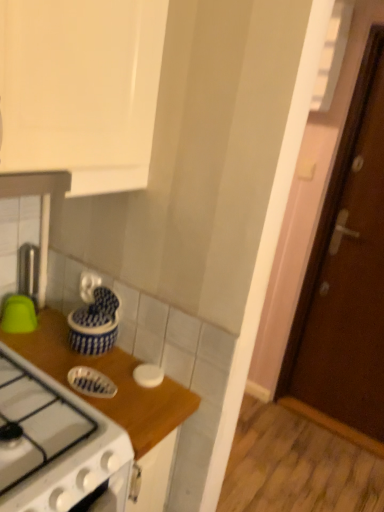
Question: Can you confirm if blue glossy dish at center, arranged as the 2th kitchen appliance when viewed from the right, is taller than brown wooden door at right?

Choices:
 (A) no
 (B) yes

Answer: (A)

Question: Is the position of blue glossy dish at center, arranged as the 2th kitchen appliance when viewed from the right, more distant than that of brown wooden door at right?

Choices:
 (A) no
 (B) yes

Answer: (A)

Question: From the image's perspective, does blue glossy dish at center, arranged as the 2th kitchen appliance when viewed from the right, appear higher than brown wooden door at right?

Choices:
 (A) no
 (B) yes

Answer: (A)

Question: From a real-world perspective, is blue glossy dish at center, arranged as the 2th kitchen appliance when viewed from the right, positioned over brown wooden door at right based on gravity?

Choices:
 (A) yes
 (B) no

Answer: (B)

Question: Considering the relative sizes of blue glossy dish at center, the 3th kitchen appliance from the left, and brown wooden door at right in the image provided, is blue glossy dish at center, the 3th kitchen appliance from the left, shorter than brown wooden door at right?

Choices:
 (A) yes
 (B) no

Answer: (A)

Question: Is wooden at upper right taller or shorter than blue glossy jar at center, which ranks as the third kitchen appliance in right-to-left order?

Choices:
 (A) short
 (B) tall

Answer: (B)

Question: Does point 135,428 appear closer or farther from the camera than point 89,338?

Choices:
 (A) farther
 (B) closer

Answer: (B)

Question: Considering their positions, is wooden at upper right located in front of or behind blue glossy jar at center, which is counted as the second kitchen appliance, starting from the left?

Choices:
 (A) behind
 (B) front

Answer: (B)

Question: Is wooden at upper right bigger or smaller than blue glossy jar at center, which is counted as the second kitchen appliance, starting from the left?

Choices:
 (A) small
 (B) big

Answer: (B)

Question: Looking at their shapes, would you say green matte bowl at left, acting as the fourth kitchen appliance starting from the right, is wider or thinner than blue glossy jar at center, which is counted as the second kitchen appliance, starting from the left?

Choices:
 (A) wide
 (B) thin

Answer: (B)

Question: From a real-world perspective, is green matte bowl at left, acting as the fourth kitchen appliance starting from the right, positioned above or below blue glossy jar at center, which ranks as the third kitchen appliance in right-to-left order?

Choices:
 (A) above
 (B) below

Answer: (B)

Question: From the image's perspective, is green matte bowl at left, acting as the fourth kitchen appliance starting from the right, above or below blue glossy jar at center, which ranks as the third kitchen appliance in right-to-left order?

Choices:
 (A) above
 (B) below

Answer: (A)

Question: Is green matte bowl at left, placed as the 1th kitchen appliance when sorted from left to right, taller or shorter than blue glossy jar at center, which ranks as the third kitchen appliance in right-to-left order?

Choices:
 (A) tall
 (B) short

Answer: (B)

Question: From the image's perspective, is wooden at upper right positioned above or below brown wooden door at right?

Choices:
 (A) below
 (B) above

Answer: (A)

Question: Does point (57, 377) appear closer or farther from the camera than point (326, 288)?

Choices:
 (A) farther
 (B) closer

Answer: (B)